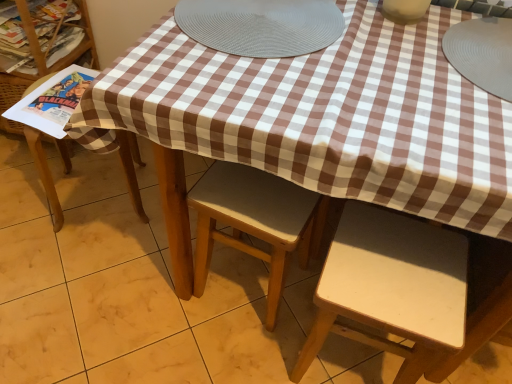
Identify the location of blank area beneath light brown wood chair at center, which appears as the second chair when viewed from the left (from a real-world perspective). (250, 284).